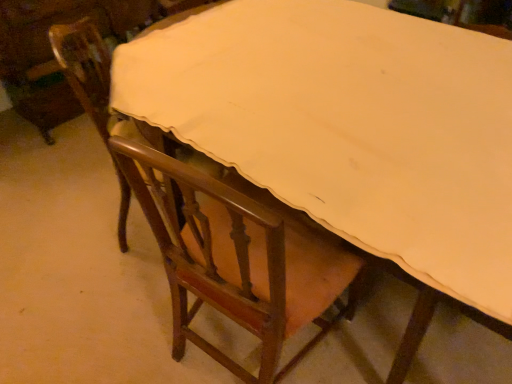
Question: From the image's perspective, is wooden chair at left, the 2th chair when ordered from right to left, positioned above or below wooden chair at center, the second chair when ordered from left to right?

Choices:
 (A) above
 (B) below

Answer: (A)

Question: Considering the positions of wooden chair at left, the 2th chair when ordered from right to left, and wooden chair at center, the second chair when ordered from left to right, in the image, is wooden chair at left, the 2th chair when ordered from right to left, taller or shorter than wooden chair at center, the second chair when ordered from left to right,?

Choices:
 (A) tall
 (B) short

Answer: (B)

Question: In the image, is wooden chair at left, placed as the 1th chair when sorted from left to right, on the left side or the right side of wooden chair at center, the second chair when ordered from left to right?

Choices:
 (A) right
 (B) left

Answer: (B)

Question: In terms of size, does wooden chair at center, the second chair when ordered from left to right, appear bigger or smaller than wooden chair at left, placed as the 1th chair when sorted from left to right?

Choices:
 (A) big
 (B) small

Answer: (A)

Question: From a real-world perspective, is wooden chair at center, the second chair when ordered from left to right, physically located above or below wooden chair at left, placed as the 1th chair when sorted from left to right?

Choices:
 (A) above
 (B) below

Answer: (A)

Question: Based on their positions, is wooden chair at center, which is the first chair from right to left, located to the left or right of wooden chair at left, the 2th chair when ordered from right to left?

Choices:
 (A) left
 (B) right

Answer: (B)

Question: In the image, is wooden chair at center, the second chair when ordered from left to right, positioned in front of or behind wooden chair at left, the 2th chair when ordered from right to left?

Choices:
 (A) front
 (B) behind

Answer: (A)